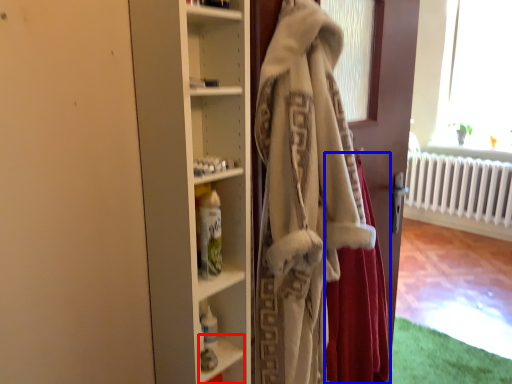
Question: Which of the following is the closest to the observer, shelf (highlighted by a red box) or shawl (highlighted by a blue box)?

Choices:
 (A) shelf
 (B) shawl

Answer: (B)